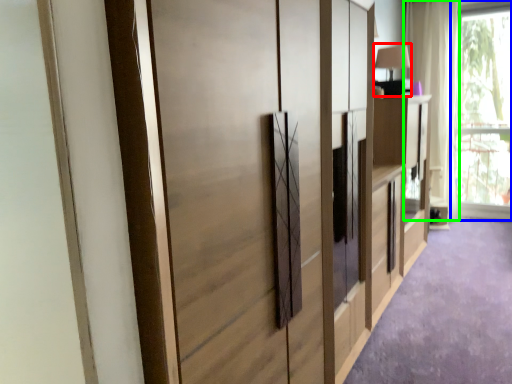
Question: Based on their relative distances, which object is nearer to table lamp (highlighted by a red box)? Choose from window (highlighted by a blue box) and curtain (highlighted by a green box).

Choices:
 (A) window
 (B) curtain

Answer: (B)